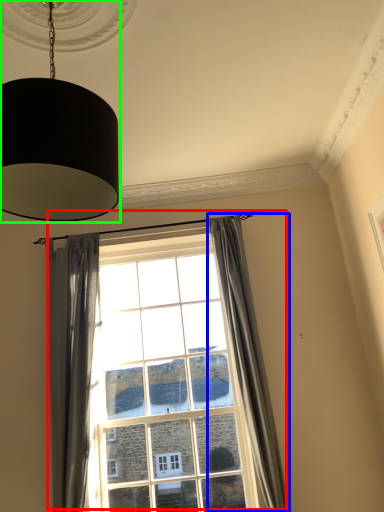
Question: Which object is positioned closest to window (highlighted by a red box)? Select from curtain (highlighted by a blue box) and lamp (highlighted by a green box).

Choices:
 (A) curtain
 (B) lamp

Answer: (A)